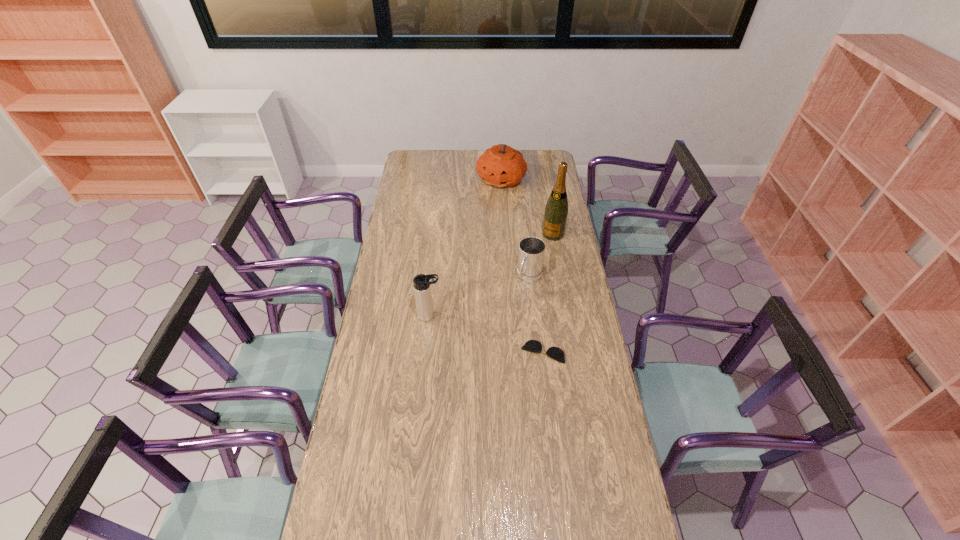
Where is `vacant space in between the pumpkin and the leftmost object`? The image size is (960, 540). vacant space in between the pumpkin and the leftmost object is located at coordinates (466, 248).

The image size is (960, 540). Find the location of `vacant space in between the tallest object and the second nearest object`. vacant space in between the tallest object and the second nearest object is located at coordinates (492, 275).

The height and width of the screenshot is (540, 960). I want to click on free space between the shortest object and the leftmost object, so click(x=486, y=334).

Locate an element on the screen. free area in between the spectacles and the leftmost object is located at coordinates (486, 334).

Locate an element on the screen. The height and width of the screenshot is (540, 960). free area in between the farthest object and the third farthest object is located at coordinates (x=516, y=228).

Where is `vacant point located between the pumpkin and the mug`? The image size is (960, 540). vacant point located between the pumpkin and the mug is located at coordinates [516, 228].

This screenshot has height=540, width=960. Identify the location of object that is the second closest to the farthest object. (531, 253).

Find the location of a particular element. This screenshot has width=960, height=540. object that can be found as the fourth closest to the spectacles is located at coordinates (501, 166).

This screenshot has height=540, width=960. I want to click on vacant position in the image that satisfies the following two spatial constraints: 1. on the front side of the pumpkin; 2. on the right side of the second farthest object, so click(x=504, y=234).

The width and height of the screenshot is (960, 540). Find the location of `free space that satisfies the following two spatial constraints: 1. on the front side of the second shortest object; 2. on the left side of the pumpkin`. free space that satisfies the following two spatial constraints: 1. on the front side of the second shortest object; 2. on the left side of the pumpkin is located at coordinates (507, 276).